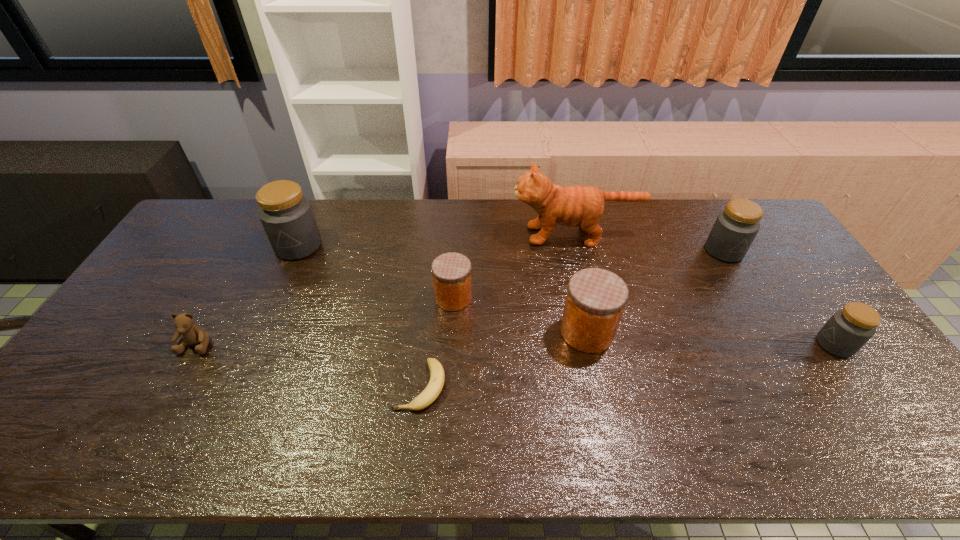
Find the location of a particular element. gray jar that is the second closest to the leftmost object is located at coordinates (735, 228).

You are a GUI agent. You are given a task and a screenshot of the screen. Output one action in this format:
    pyautogui.click(x=<x>, y=<y>)
    Task: Click on the free space in the image that satisfies the following two spatial constraints: 1. on the face of the tallest object; 2. on the front-facing side of the teddy bear
    
    Given the screenshot: What is the action you would take?
    (x=601, y=344)

In order to click on free location that satisfies the following two spatial constraints: 1. on the front side of the left orange jar; 2. on the right side of the bigger orange jar in this screenshot , I will do `click(451, 332)`.

Identify the location of free space in the image that satisfies the following two spatial constraints: 1. on the surface of the banana near the warning symbol; 2. on the right side of the biggest gray jar. (236, 386).

Locate an element on the screen. vacant point that satisfies the following two spatial constraints: 1. on the front-facing side of the shortest object; 2. on the right side of the leftmost object is located at coordinates (174, 386).